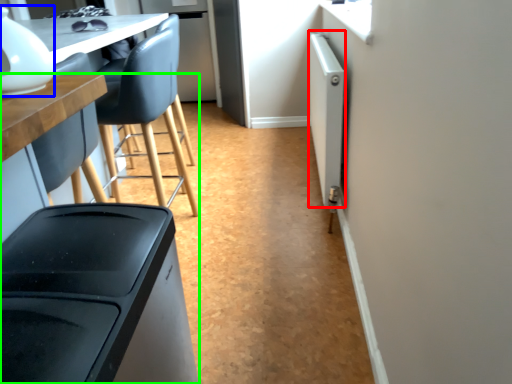
Question: Estimate the real-world distances between objects in this image. Which object is farther from appliance (highlighted by a red box), appliance (highlighted by a blue box) or table (highlighted by a green box)?

Choices:
 (A) appliance
 (B) table

Answer: (A)